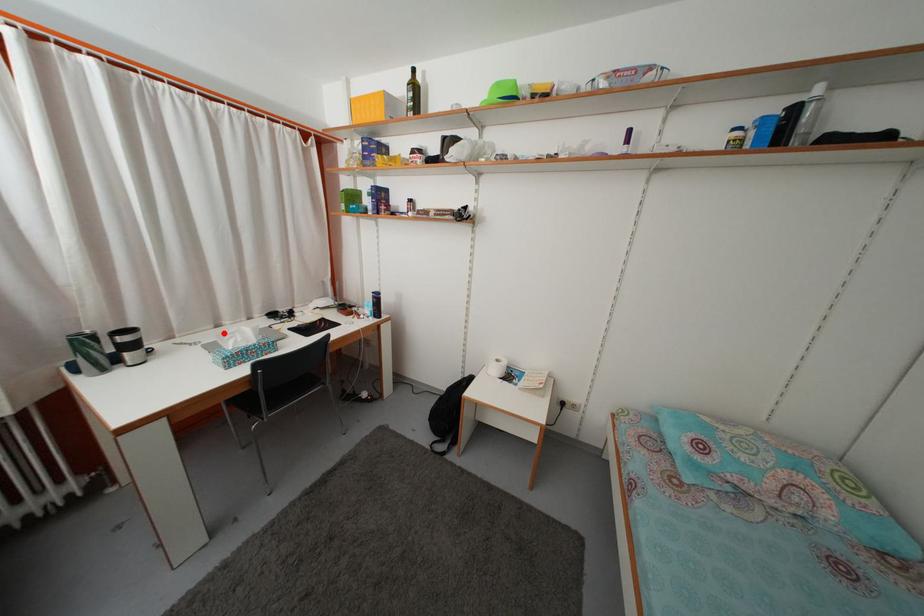
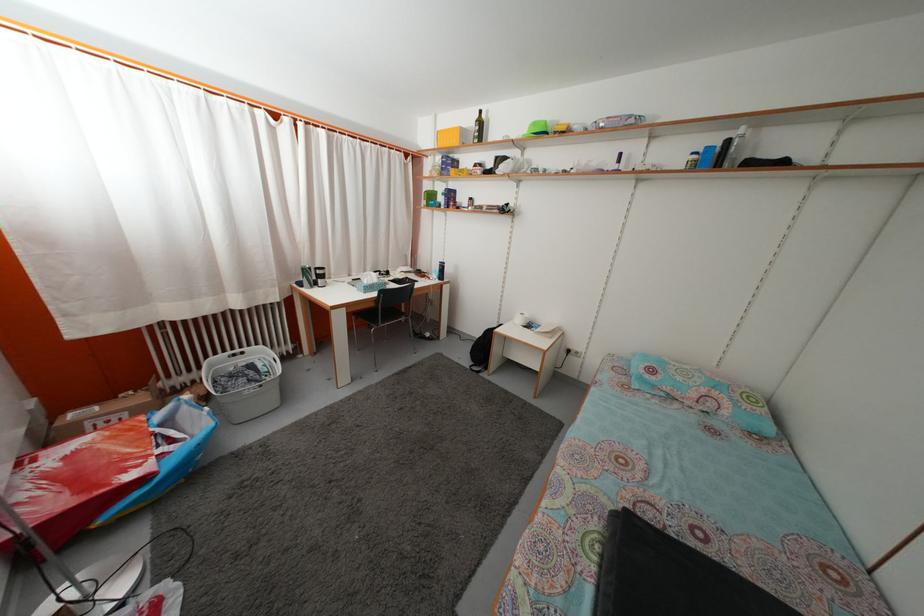
Question: I am providing you with two images of the same scene from different viewpoints. A red point is marked on the first image. At the location where the point appears in image 1, is it still visible in image 2?

Choices:
 (A) Yes
 (B) No

Answer: (A)